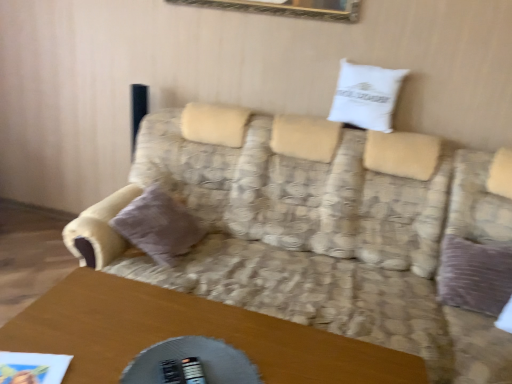
Question: From their relative heights in the image, would you say wooden table at lower center is taller or shorter than white cotton pillow at upper center, which appears as the first pillow when viewed from the top?

Choices:
 (A) short
 (B) tall

Answer: (B)

Question: Based on their sizes in the image, would you say wooden table at lower center is bigger or smaller than white cotton pillow at upper center, which appears as the first pillow when viewed from the top?

Choices:
 (A) big
 (B) small

Answer: (A)

Question: Which object is positioned farthest from the white cotton pillow at upper center, which appears as the first pillow when viewed from the top?

Choices:
 (A) wooden table at lower center
 (B) patterned fabric couch at center
 (C) velvet purple pillow at left, positioned as the 1th pillow in left-to-right order

Answer: (A)

Question: Which of these objects is positioned closest to the patterned fabric couch at center?

Choices:
 (A) velvet purple pillow at left, positioned as the 1th pillow in left-to-right order
 (B) white cotton pillow at upper center, which appears as the first pillow when viewed from the top
 (C) wooden table at lower center

Answer: (A)